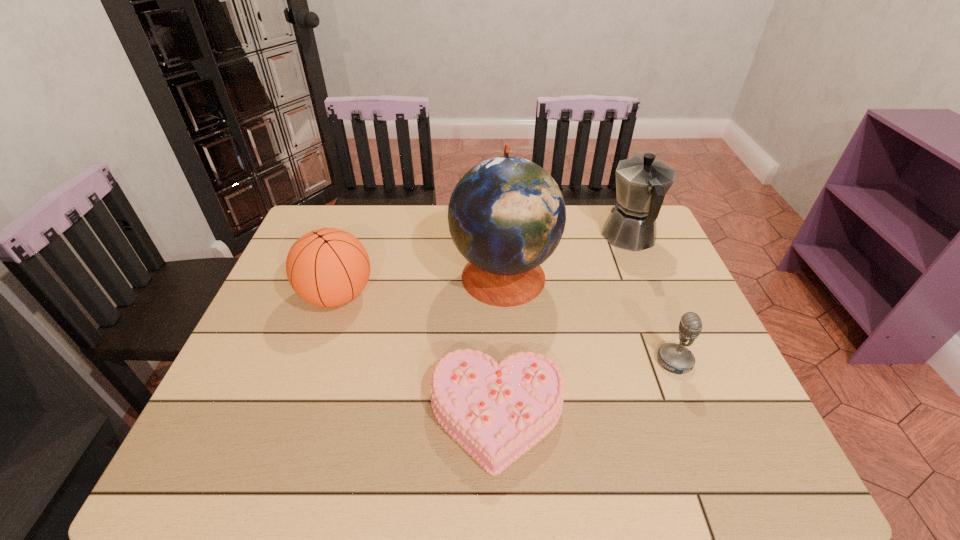
Locate an element on the screen. The image size is (960, 540). the tallest object is located at coordinates pos(506,215).

Locate an element on the screen. the fourth shortest object is located at coordinates (641, 182).

The image size is (960, 540). Identify the location of basketball. (327, 267).

Identify the location of the third shortest object. (327, 267).

At what (x,y) coordinates should I click in order to perform the action: click on the second shortest object. Please return your answer as a coordinate pair (x, y). The width and height of the screenshot is (960, 540). Looking at the image, I should click on (676, 358).

The width and height of the screenshot is (960, 540). Identify the location of cake. (496, 411).

At what (x,y) coordinates should I click in order to perform the action: click on vacant position located 0.250m with the Americas facing the viewer on the tallest object. Please return your answer as a coordinate pair (x, y). Looking at the image, I should click on (363, 274).

Find the location of a particular element. free location located with the Americas facing the viewer on the tallest object is located at coordinates (310, 274).

You are a GUI agent. You are given a task and a screenshot of the screen. Output one action in this format:
    pyautogui.click(x=<x>, y=<y>)
    Task: Click on the free space located with the Americas facing the viewer on the tallest object
    
    Given the screenshot: What is the action you would take?
    pyautogui.click(x=356, y=274)

You are a GUI agent. You are given a task and a screenshot of the screen. Output one action in this format:
    pyautogui.click(x=<x>, y=<y>)
    Task: Click on the free point located 0.120m on the back of the leftmost object
    The height and width of the screenshot is (540, 960).
    Given the screenshot: What is the action you would take?
    pyautogui.click(x=354, y=245)